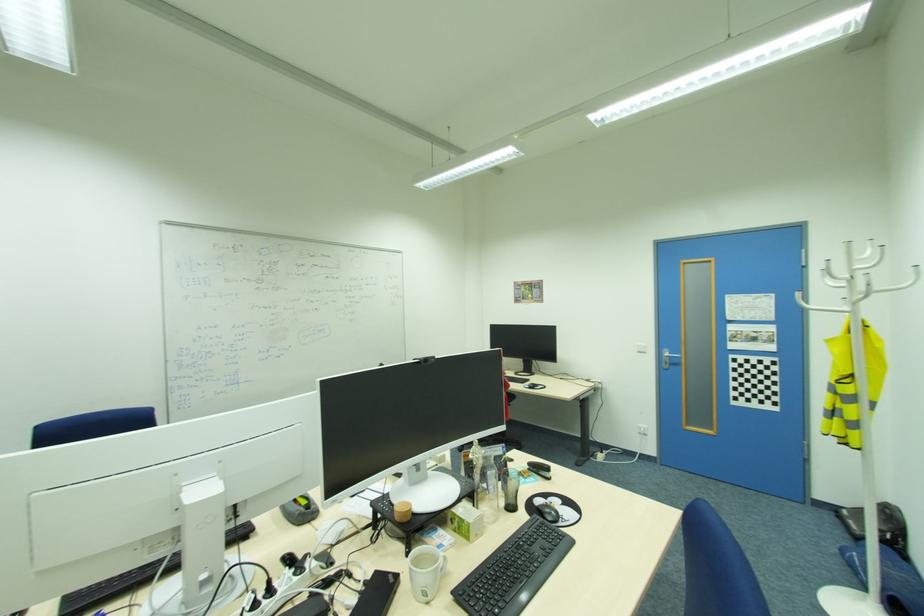
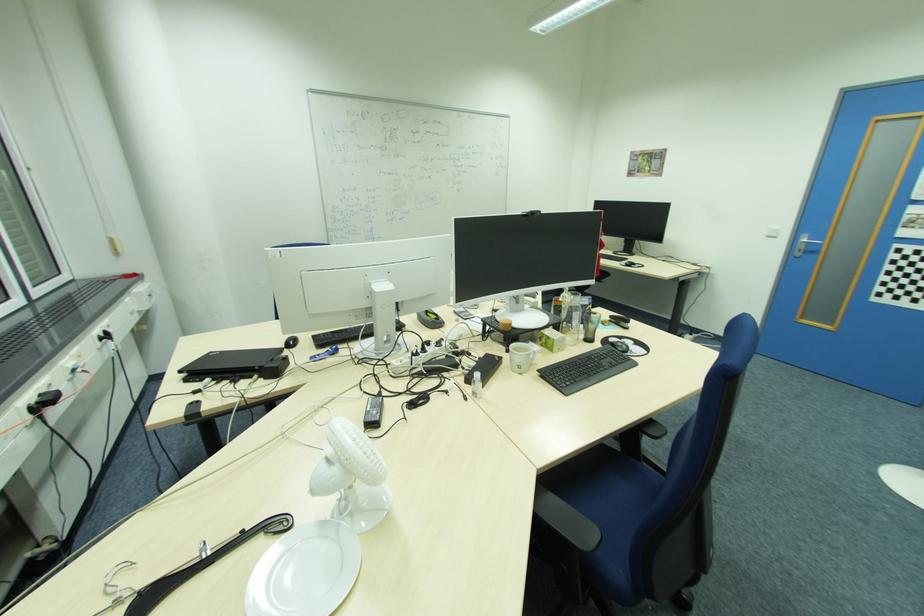
Where in the second image is the point corresponding to point 445,537 from the first image?

(536, 346)